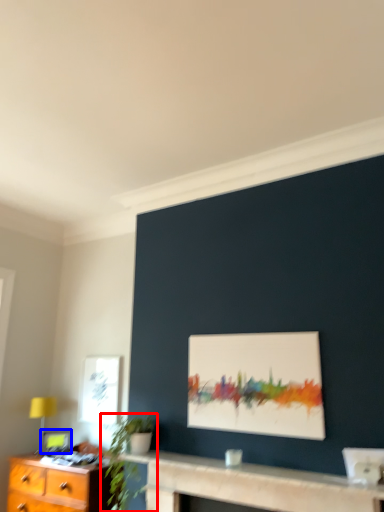
Question: Which object appears farthest to the camera in this image, houseplant (highlighted by a red box) or picture frame (highlighted by a blue box)?

Choices:
 (A) houseplant
 (B) picture frame

Answer: (B)